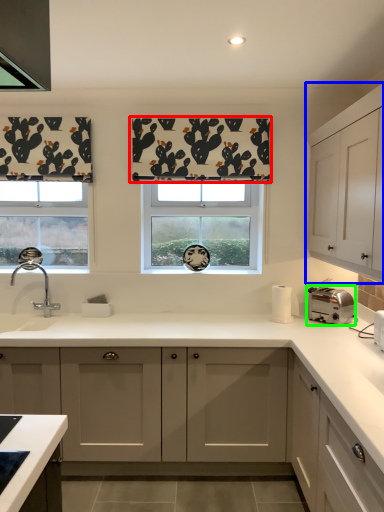
Question: Which object is positioned closest to curtain (highlighted by a red box)? Select from cabinetry (highlighted by a blue box) and toaster (highlighted by a green box).

Choices:
 (A) cabinetry
 (B) toaster

Answer: (A)